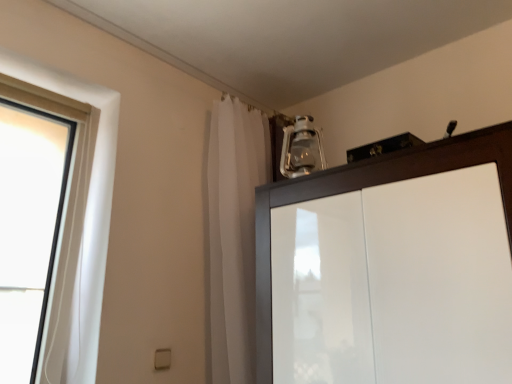
Image resolution: width=512 pixels, height=384 pixels. What do you see at coordinates (301, 149) in the screenshot? I see `clear glass lantern at upper center` at bounding box center [301, 149].

Find the location of a particular element. white sheer curtain at upper center is located at coordinates (234, 234).

Does clear glass lantern at upper center come in front of glossy wood cupboard at upper right?

No, clear glass lantern at upper center is further to the viewer.

From the image's perspective, is clear glass lantern at upper center positioned above or below glossy wood cupboard at upper right?

clear glass lantern at upper center is above glossy wood cupboard at upper right.

Which of these two, clear glass lantern at upper center or glossy wood cupboard at upper right, stands taller?

With more height is glossy wood cupboard at upper right.

From their relative heights in the image, would you say glossy wood cupboard at upper right is taller or shorter than clear glass lantern at upper center?

Considering their sizes, glossy wood cupboard at upper right has more height than clear glass lantern at upper center.

Is glossy wood cupboard at upper right in contact with clear glass lantern at upper center?

They are not placed beside each other.

Considering the relative positions of glossy wood cupboard at upper right and clear glass lantern at upper center in the image provided, is glossy wood cupboard at upper right to the right of clear glass lantern at upper center from the viewer's perspective?

Yes, glossy wood cupboard at upper right is to the right of clear glass lantern at upper center.

Between glossy wood cupboard at upper right and clear glass lantern at upper center, which one has larger size?

glossy wood cupboard at upper right.

Which object is wider, clear glass lantern at upper center or white sheer curtain at upper center?

Wider between the two is white sheer curtain at upper center.

Based on the photo, is clear glass lantern at upper center inside the boundaries of white sheer curtain at upper center, or outside?

The correct answer is: outside.

From a real-world perspective, is clear glass lantern at upper center beneath white sheer curtain at upper center?

No.

Locate an element on the screen. This screenshot has width=512, height=384. shower curtain below the clear glass lantern at upper center (from the image's perspective) is located at coordinates (234, 234).

Which object is closer to the camera taking this photo, white sheer curtain at upper center or clear glass lantern at upper center?

white sheer curtain at upper center is closer to the camera.

Considering the sizes of objects white sheer curtain at upper center and clear glass lantern at upper center in the image provided, who is thinner, white sheer curtain at upper center or clear glass lantern at upper center?

clear glass lantern at upper center.

Could you tell me if white sheer curtain at upper center is facing clear glass lantern at upper center?

Yes, white sheer curtain at upper center is facing clear glass lantern at upper center.

Which is more to the right, white sheer curtain at upper center or clear glass lantern at upper center?

Positioned to the right is clear glass lantern at upper center.

Is glossy wood cupboard at upper right aimed at white sheer curtain at upper center?

No, glossy wood cupboard at upper right is not oriented towards white sheer curtain at upper center.

Is white sheer curtain at upper center inside glossy wood cupboard at upper right?

No, glossy wood cupboard at upper right does not contain white sheer curtain at upper center.

Which of these two, glossy wood cupboard at upper right or white sheer curtain at upper center, is wider?

glossy wood cupboard at upper right is wider.

Is glossy wood cupboard at upper right not close to white sheer curtain at upper center?

They are positioned close to each other.

Is white sheer curtain at upper center next to glossy wood cupboard at upper right and touching it?

No.

Looking at this image, is white sheer curtain at upper center not within glossy wood cupboard at upper right?

Yes, white sheer curtain at upper center is not within glossy wood cupboard at upper right.

Does white sheer curtain at upper center turn towards glossy wood cupboard at upper right?

Yes, white sheer curtain at upper center is aimed at glossy wood cupboard at upper right.

Considering the relative sizes of white sheer curtain at upper center and glossy wood cupboard at upper right in the image provided, is white sheer curtain at upper center taller than glossy wood cupboard at upper right?

Correct, white sheer curtain at upper center is much taller as glossy wood cupboard at upper right.

You are a GUI agent. You are given a task and a screenshot of the screen. Output one action in this format:
    pyautogui.click(x=<x>, y=<y>)
    Task: Click on the light fixture on the left of the glossy wood cupboard at upper right
    The height and width of the screenshot is (384, 512).
    Given the screenshot: What is the action you would take?
    pyautogui.click(x=301, y=149)

Find the location of a particular element. Image resolution: width=512 pixels, height=384 pixels. light fixture lying above the glossy wood cupboard at upper right (from the image's perspective) is located at coordinates (301, 149).

Estimate the real-world distances between objects in this image. Which object is closer to glossy wood cupboard at upper right, white sheer curtain at upper center or clear glass lantern at upper center?

Based on the image, white sheer curtain at upper center appears to be nearer to glossy wood cupboard at upper right.

Looking at the image, which one is located closer to glossy wood cupboard at upper right, clear glass lantern at upper center or white sheer curtain at upper center?

white sheer curtain at upper center.

Based on their spatial positions, is glossy wood cupboard at upper right or clear glass lantern at upper center closer to white sheer curtain at upper center?

The object closer to white sheer curtain at upper center is clear glass lantern at upper center.

When comparing their distances from clear glass lantern at upper center, does white sheer curtain at upper center or glossy wood cupboard at upper right seem closer?

white sheer curtain at upper center is positioned closer to the anchor clear glass lantern at upper center.

When comparing their distances from clear glass lantern at upper center, does glossy wood cupboard at upper right or white sheer curtain at upper center seem further?

The object further to clear glass lantern at upper center is glossy wood cupboard at upper right.

From the image, which object appears to be farther from white sheer curtain at upper center, clear glass lantern at upper center or glossy wood cupboard at upper right?

The object further to white sheer curtain at upper center is glossy wood cupboard at upper right.

Identify the location of shower curtain between glossy wood cupboard at upper right and clear glass lantern at upper center from front to back. (234, 234).